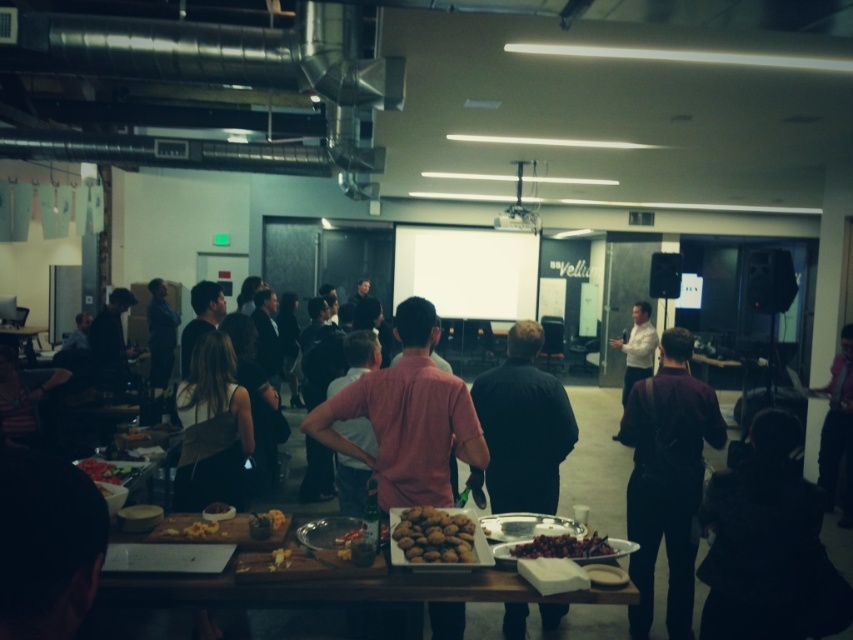
Does point (782, 548) come in front of point (9, 332)?

Yes, point (782, 548) is in front of point (9, 332).

Between dark fabric jacket at lower right and wooden cutting board at lower left, which one is positioned higher?

wooden cutting board at lower left

Image resolution: width=853 pixels, height=640 pixels. Describe the element at coordinates (769, 545) in the screenshot. I see `dark fabric jacket at lower right` at that location.

Where is `dark fabric jacket at lower right`? dark fabric jacket at lower right is located at coordinates (769, 545).

Is dark fabric jacket at lower right taller than white matte projection screen at center?

In fact, dark fabric jacket at lower right may be shorter than white matte projection screen at center.

Between dark fabric jacket at lower right and white matte projection screen at center, which one is positioned lower?

Positioned lower is dark fabric jacket at lower right.

Is point (738, 616) positioned before point (453, 275)?

Yes, point (738, 616) is in front of point (453, 275).

Find the location of a particular element. The image size is (853, 640). dark fabric jacket at lower right is located at coordinates (769, 545).

Between matte black shirt at left and shiny metallic nuts at center, which one has less height?

With less height is shiny metallic nuts at center.

Between matte black shirt at left and shiny metallic nuts at center, which one is positioned higher?

matte black shirt at left is higher up.

The height and width of the screenshot is (640, 853). Find the location of `matte black shirt at left`. matte black shirt at left is located at coordinates (160, 333).